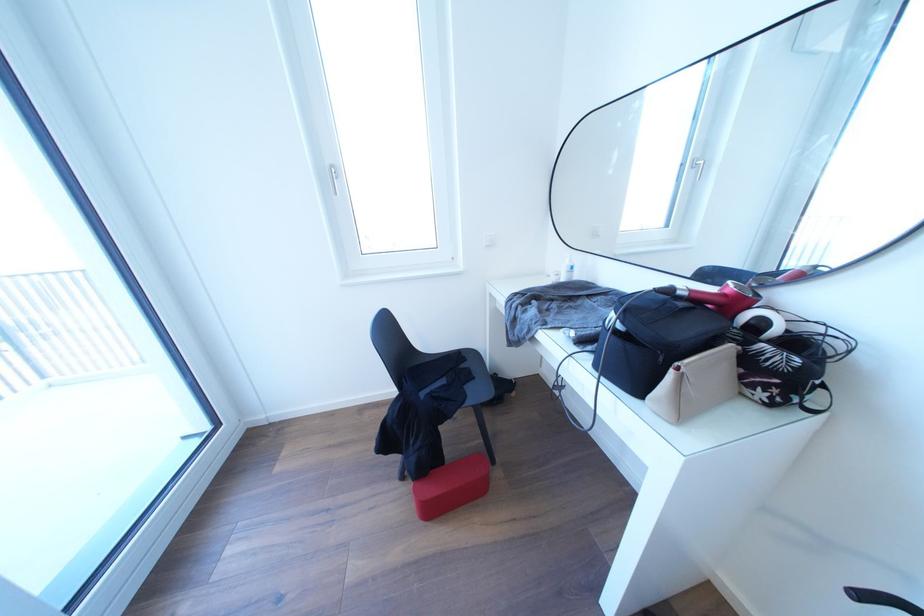
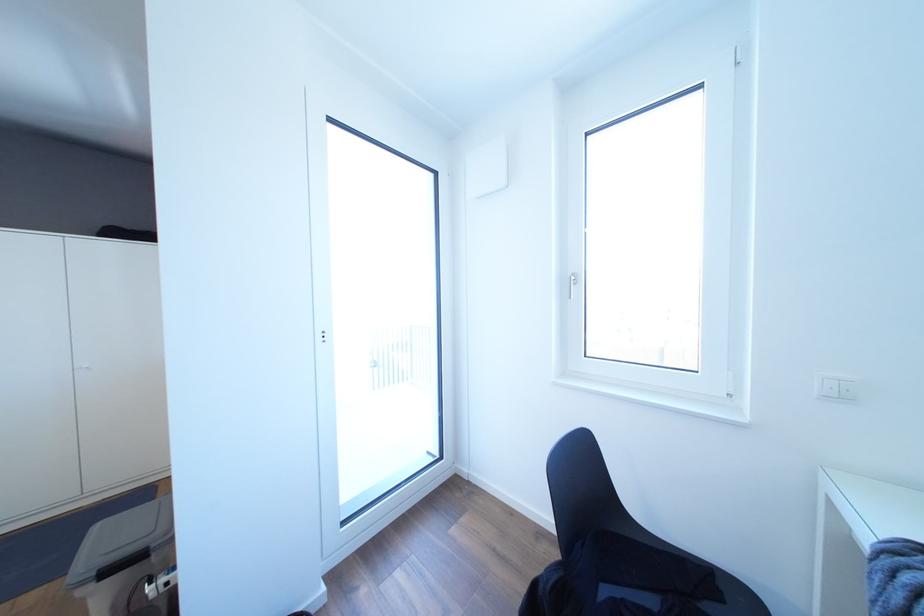
Question: The camera is either moving clockwise (left) or counter-clockwise (right) around the object. The first image is from the beginning of the video and the second image is from the end. Is the camera moving left or right when shooting the video?

Choices:
 (A) Left
 (B) Right

Answer: (B)